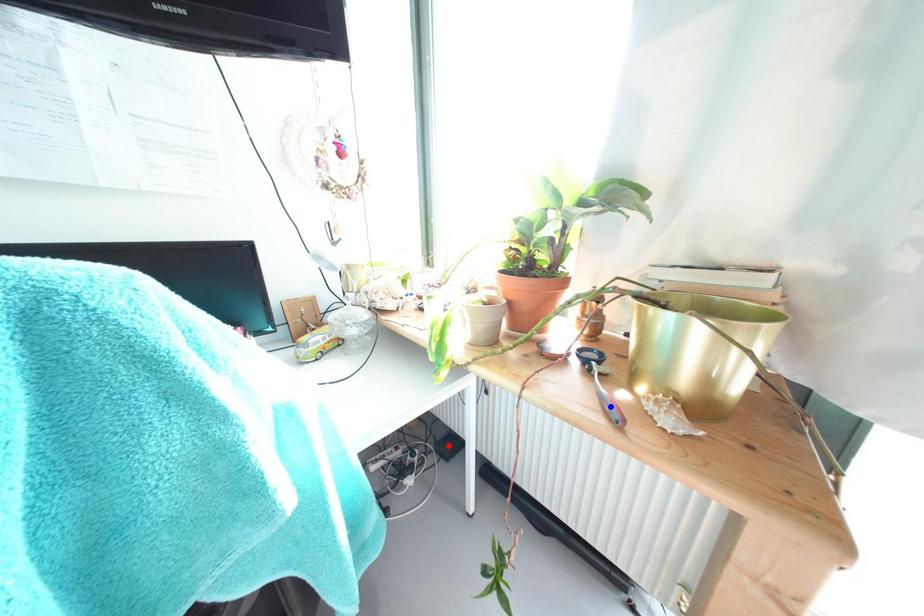
Question: Two points are marked on the image. Which point is closer to the camera?

Choices:
 (A) Blue point is closer.
 (B) Red point is closer.

Answer: (A)